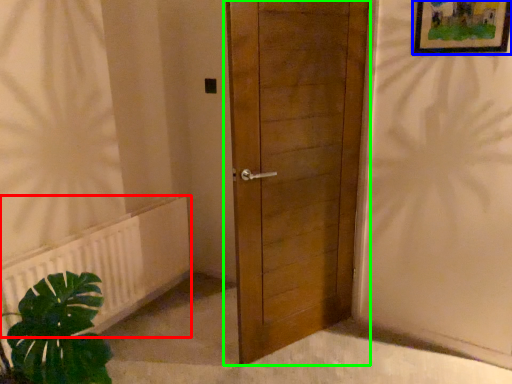
Question: Which object is positioned farthest from radiator (highlighted by a red box)? Select from picture frame (highlighted by a blue box) and door (highlighted by a green box).

Choices:
 (A) picture frame
 (B) door

Answer: (A)